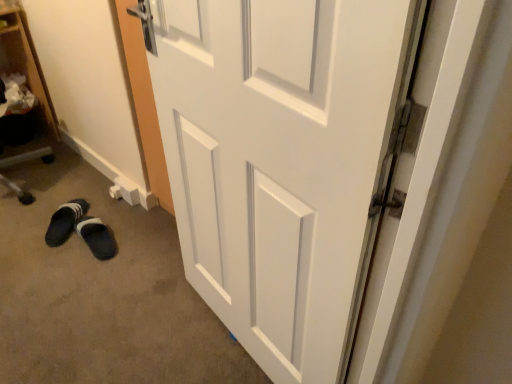
Question: From a real-world perspective, is wooden bookshelf at left beneath black fabric slipper at lower left?

Choices:
 (A) yes
 (B) no

Answer: (B)

Question: Is wooden bookshelf at left further to the viewer compared to black fabric slipper at lower left?

Choices:
 (A) yes
 (B) no

Answer: (B)

Question: From a real-world perspective, is wooden bookshelf at left physically above black fabric slipper at lower left?

Choices:
 (A) no
 (B) yes

Answer: (B)

Question: Is wooden bookshelf at left looking in the opposite direction of black fabric slipper at lower left?

Choices:
 (A) no
 (B) yes

Answer: (A)

Question: Does wooden bookshelf at left lie in front of black fabric slipper at lower left?

Choices:
 (A) yes
 (B) no

Answer: (A)

Question: Is wooden bookshelf at left wider than black fabric slipper at lower left?

Choices:
 (A) no
 (B) yes

Answer: (B)

Question: Does black fabric slipper at lower left have a greater width compared to white glossy door at center?

Choices:
 (A) no
 (B) yes

Answer: (B)

Question: Is black fabric slipper at lower left outside white glossy door at center?

Choices:
 (A) no
 (B) yes

Answer: (B)

Question: Is black fabric slipper at lower left looking in the opposite direction of white glossy door at center?

Choices:
 (A) yes
 (B) no

Answer: (B)

Question: From a real-world perspective, is black fabric slipper at lower left beneath white glossy door at center?

Choices:
 (A) yes
 (B) no

Answer: (A)

Question: Does black fabric slipper at lower left turn towards white glossy door at center?

Choices:
 (A) no
 (B) yes

Answer: (A)

Question: Is black fabric slipper at lower left thinner than white glossy door at center?

Choices:
 (A) no
 (B) yes

Answer: (A)

Question: Are black fabric slipper at lower left and black suede slipper at lower left beside each other?

Choices:
 (A) yes
 (B) no

Answer: (A)